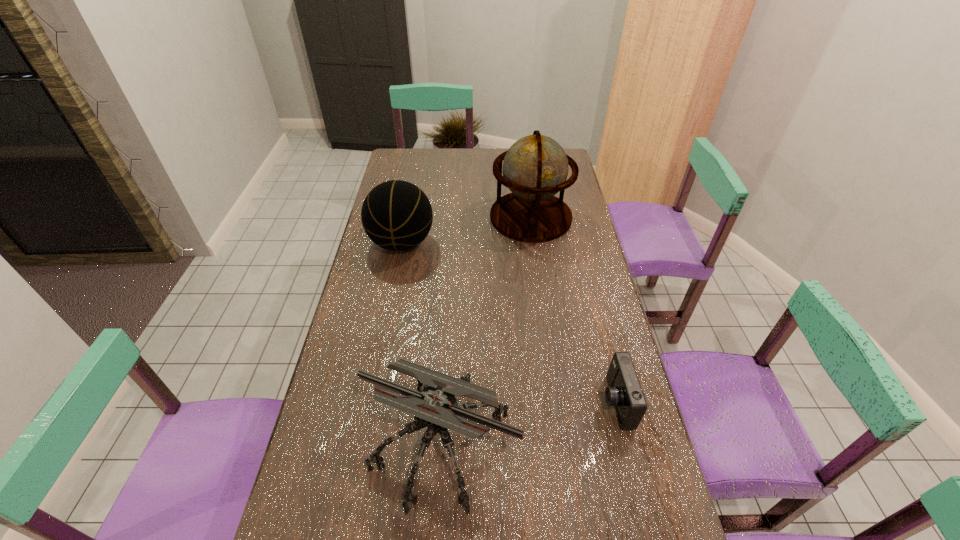
Where is `basketball that is at the left edge`? basketball that is at the left edge is located at coordinates (396, 215).

The height and width of the screenshot is (540, 960). Identify the location of drone situated at the left edge. [x=436, y=407].

Identify the location of globe at the right edge. The image size is (960, 540). (535, 168).

Locate an element on the screen. camera located in the right edge section of the desktop is located at coordinates (624, 392).

You are a GUI agent. You are given a task and a screenshot of the screen. Output one action in this format:
    pyautogui.click(x=<x>, y=<y>)
    Task: Click on the vacant point at the left edge
    
    Given the screenshot: What is the action you would take?
    pyautogui.click(x=420, y=180)

Identify the location of free space at the right edge of the desktop. (562, 276).

Find the location of `free space that is in between the basketball and the camera`. free space that is in between the basketball and the camera is located at coordinates (509, 322).

Where is `unoccupied area between the basketball and the tallest object`? This screenshot has height=540, width=960. unoccupied area between the basketball and the tallest object is located at coordinates (467, 230).

I want to click on blank region between the basketball and the camera, so click(x=509, y=322).

Locate an element on the screen. vacant space that's between the drone and the basketball is located at coordinates (421, 342).